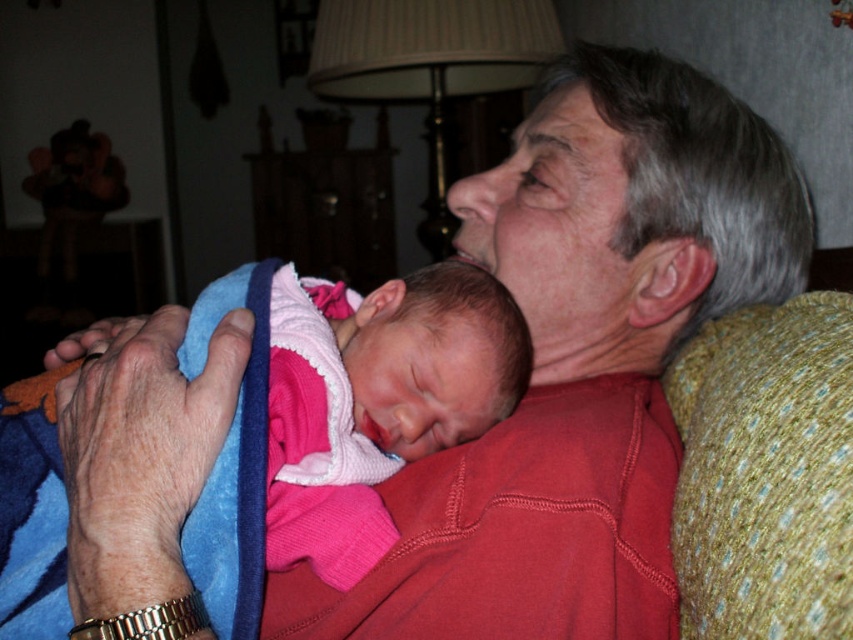
Question: Can you confirm if gray hair at upper right is positioned to the left of pink fleece blanket at center?

Choices:
 (A) no
 (B) yes

Answer: (A)

Question: Which point appears closest to the camera in this image?

Choices:
 (A) (660, 323)
 (B) (370, 413)

Answer: (B)

Question: Which of the following is the farthest from the observer?

Choices:
 (A) (698, 282)
 (B) (395, 403)

Answer: (A)

Question: Considering the relative positions of gray hair at upper right and pink fleece blanket at center in the image provided, where is gray hair at upper right located with respect to pink fleece blanket at center?

Choices:
 (A) above
 (B) below

Answer: (A)

Question: Where is gray hair at upper right located in relation to pink fleece blanket at center in the image?

Choices:
 (A) below
 (B) above

Answer: (B)

Question: Which point appears closest to the camera in this image?

Choices:
 (A) (381, 468)
 (B) (646, 291)

Answer: (A)